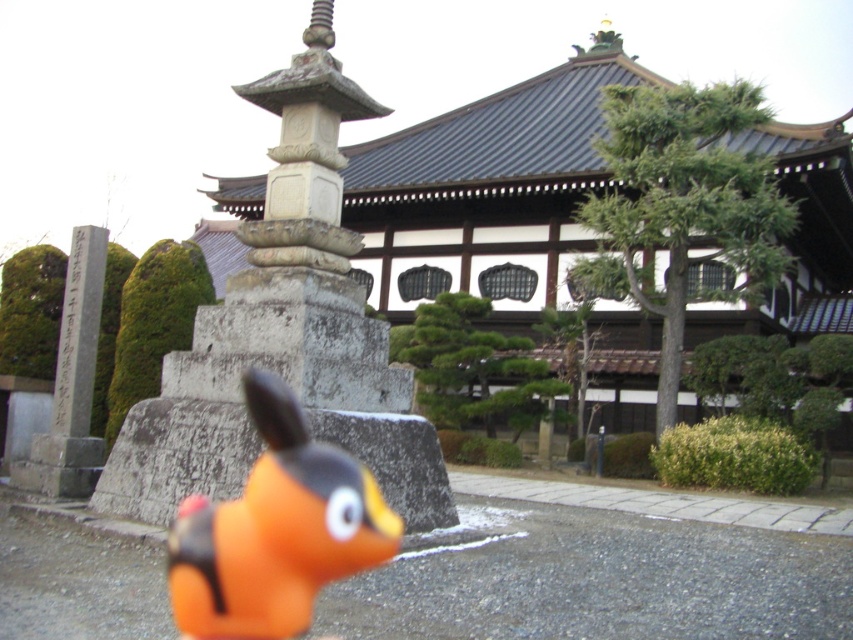
You are standing in front of the traditional Japanese temple scene. You see an orange matte toy at center and a gray stone monument at left. Which object is closer to you?

The orange matte toy at center is closer to the viewer than the gray stone monument at left.

In the scene shown: You are a visitor at the temple and want to place a small offering. The orange matte toy at center is on the right side of the gray stone monument at left. Which object should you approach first if you want to place the offering near the monument?

You should approach the gray stone monument at left first because the orange matte toy at center is positioned to its right side, meaning the monument is closer to you.